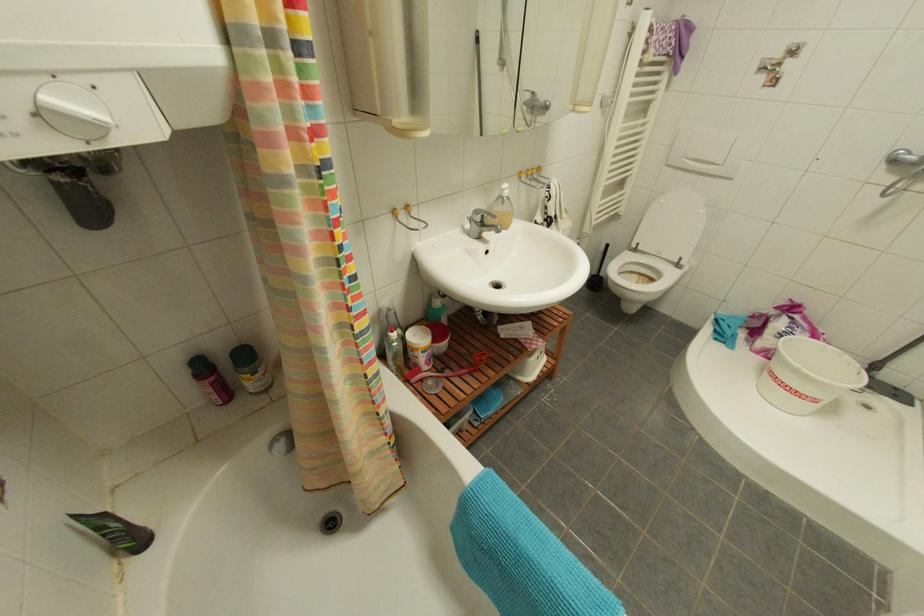
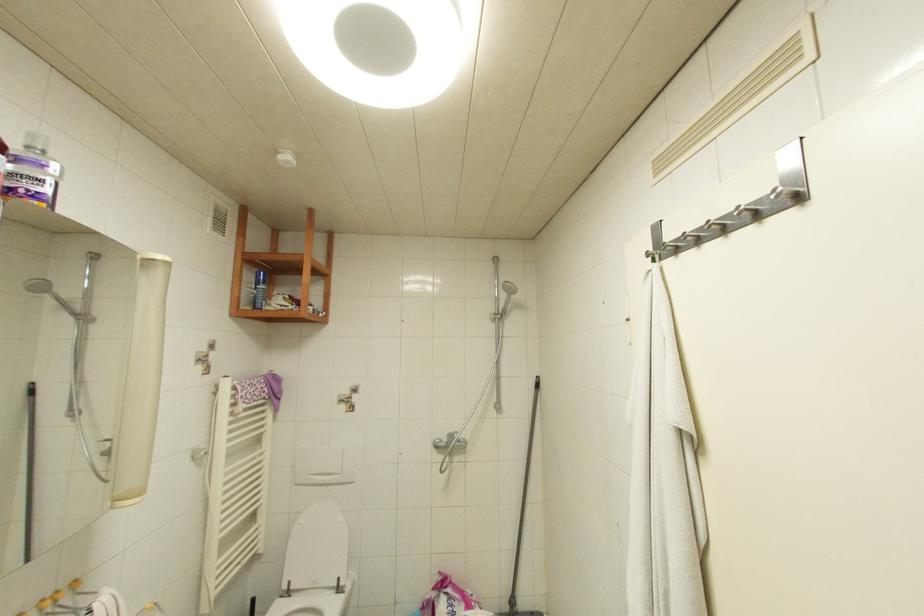
Based on the photo, first-person continuous shooting, in which direction is the camera rotating?

The camera rotated toward right-up.